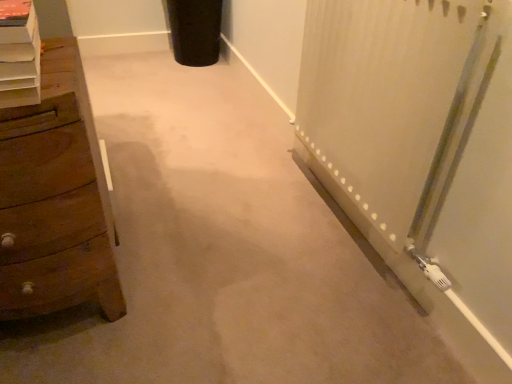
Question: Would you say white wooden shelf at left is outside wooden chest of drawers at left?

Choices:
 (A) no
 (B) yes

Answer: (B)

Question: Is white wooden shelf at left thinner than wooden chest of drawers at left?

Choices:
 (A) yes
 (B) no

Answer: (A)

Question: Is white wooden shelf at left far from wooden chest of drawers at left?

Choices:
 (A) yes
 (B) no

Answer: (B)

Question: From the image's perspective, is white wooden shelf at left located beneath wooden chest of drawers at left?

Choices:
 (A) yes
 (B) no

Answer: (B)

Question: From the image's perspective, does white wooden shelf at left appear higher than wooden chest of drawers at left?

Choices:
 (A) yes
 (B) no

Answer: (A)

Question: Is wooden chest of drawers at left at the back of white wooden shelf at left?

Choices:
 (A) yes
 (B) no

Answer: (B)

Question: From the image's perspective, is wooden chest of drawers at left on white wooden shelf at left?

Choices:
 (A) no
 (B) yes

Answer: (A)

Question: From a real-world perspective, is wooden chest of drawers at left on white wooden shelf at left?

Choices:
 (A) yes
 (B) no

Answer: (B)

Question: From the image's perspective, is wooden chest of drawers at left beneath white wooden shelf at left?

Choices:
 (A) yes
 (B) no

Answer: (A)

Question: From a real-world perspective, is wooden chest of drawers at left positioned under white wooden shelf at left based on gravity?

Choices:
 (A) yes
 (B) no

Answer: (A)

Question: Does wooden chest of drawers at left have a greater height compared to white wooden shelf at left?

Choices:
 (A) no
 (B) yes

Answer: (B)

Question: Does wooden chest of drawers at left lie behind white wooden shelf at left?

Choices:
 (A) no
 (B) yes

Answer: (B)

Question: In the image, is wooden chest of drawers at left positioned in front of or behind white wooden shelf at left?

Choices:
 (A) behind
 (B) front

Answer: (A)